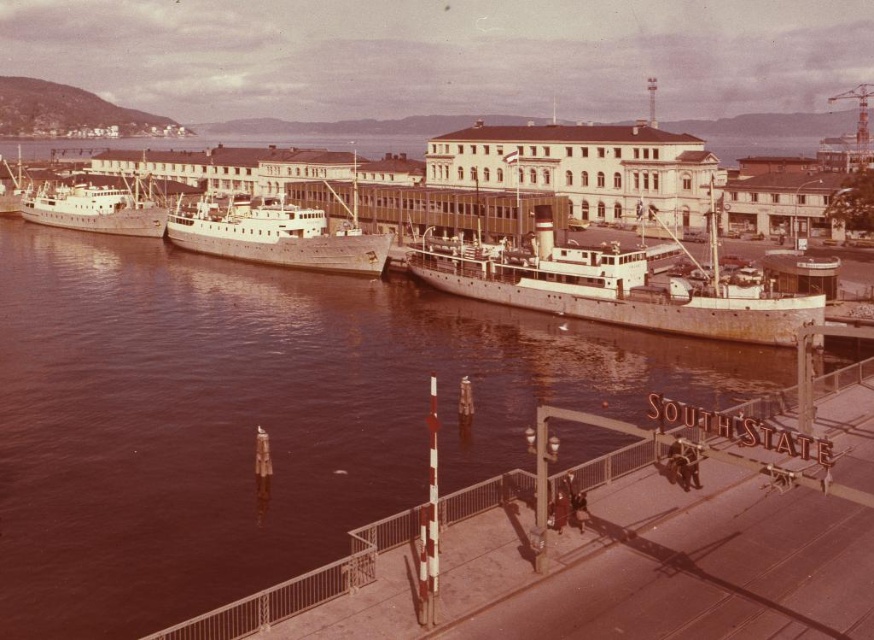
You are a delivery person who needs to unload a crate onto the white matte ship at center. The crate is 15 meters long. Can you safely place the crate from the brown water at center to the ship without overhanging the edge?

The distance between the brown water at center and the white matte ship at center is 14.30 meters. Since the crate is 15 meters long, it will overhang by 0.70 meters, making it unsafe to place the crate without extending beyond the available space.

You are a photographer trying to capture the entire scene of the brown water at center and the metallic gray ship at center in one shot. Given that your camera has a fixed focal length, which object should you focus on to ensure both are in the frame without cropping?

You should focus on the brown water at center because it has a larger size compared to the metallic gray ship at center, allowing the ship to fit within the frame when centered on the water.

You are a photographer standing at the edge of the SOUTH STATE pier. You want to capture a photo of the white matte ship at center. Based on its 2D coordinates, where should you position yourself to ensure the ship is centered in your camera frame?

To center the white matte ship at center in your camera frame, position yourself directly along the line of sight corresponding to its 2D coordinates at point (616,285).